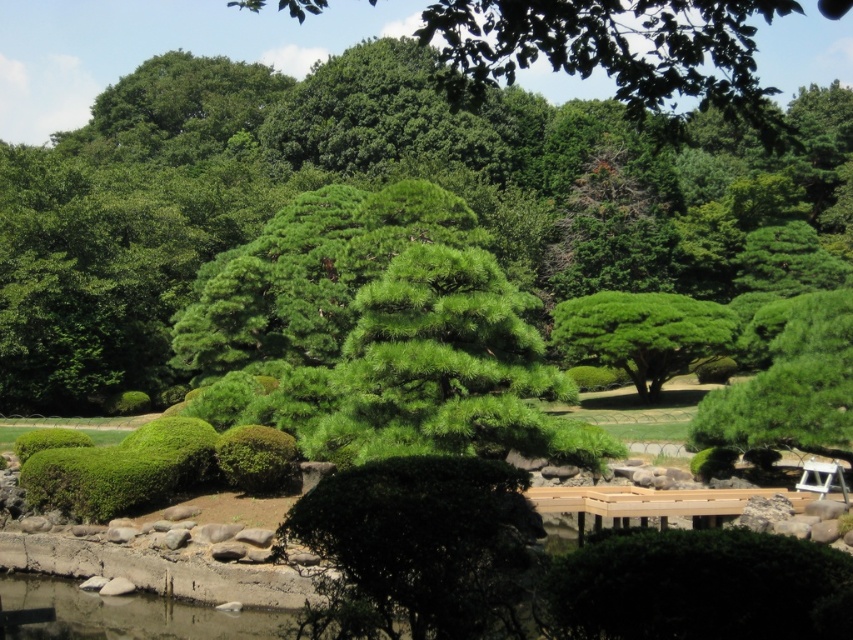
How much distance is there between dark green textured bush at center and green textured bush at center?

They are 115.61 feet apart.

Looking at this image, which is more to the right, dark green textured bush at center or green textured bush at center?

green textured bush at center

Where is `dark green textured bush at center`? This screenshot has height=640, width=853. dark green textured bush at center is located at coordinates (416, 548).

The height and width of the screenshot is (640, 853). Identify the location of dark green textured bush at center. (416, 548).

Between point (759, 618) and point (604, 310), which one is positioned in front?

Point (759, 618) is more forward.

Is dark green textured bush at lower center above green textured bush at center?

Incorrect, dark green textured bush at lower center is not positioned above green textured bush at center.

Between point (764, 563) and point (583, 316), which one is positioned behind?

Point (583, 316)

Where is `dark green textured bush at lower center`? dark green textured bush at lower center is located at coordinates (698, 588).

The image size is (853, 640). Describe the element at coordinates (416, 548) in the screenshot. I see `dark green textured bush at center` at that location.

Measure the distance between dark green textured bush at center and green fuzzy bush at center.

A distance of 40.31 feet exists between dark green textured bush at center and green fuzzy bush at center.

Between point (415, 483) and point (259, 454), which one is positioned behind?

Positioned behind is point (259, 454).

Identify the location of dark green textured bush at center. The width and height of the screenshot is (853, 640). (416, 548).